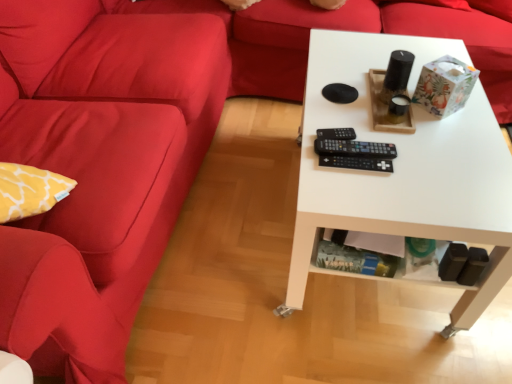
This screenshot has height=384, width=512. What are the coordinates of `free location to the right of black plastic remote at center, the 1th control when ordered from bottom to top` in the screenshot? It's located at (417, 160).